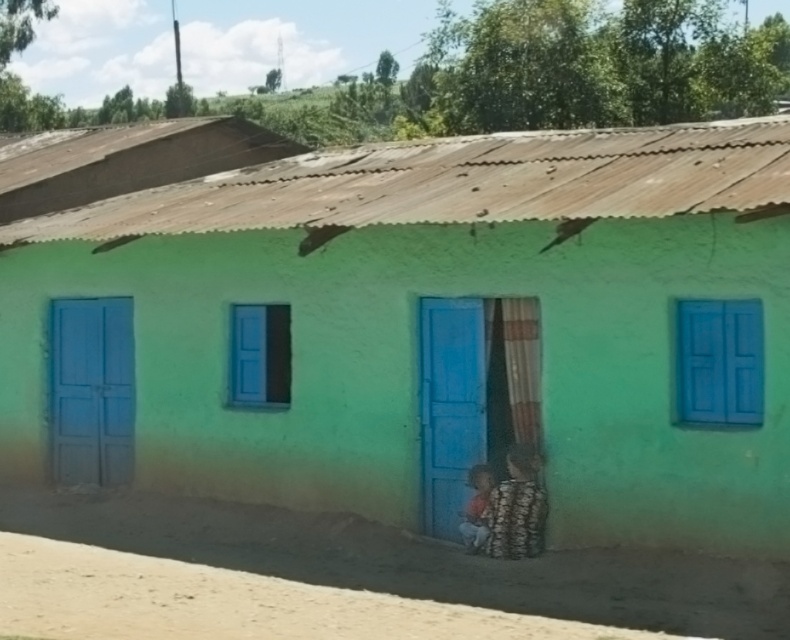
Question: Considering the real-world distances, which object is farthest from the green matte house at center?

Choices:
 (A) matte blue door at left
 (B) blue matte door at center

Answer: (A)

Question: Is green matte house at center to the right of blue matte door at center from the viewer's perspective?

Choices:
 (A) no
 (B) yes

Answer: (A)

Question: Which point is farther to the camera?

Choices:
 (A) blue matte door at center
 (B) green matte house at center
 (C) matte blue door at left

Answer: (C)

Question: Where is green matte house at center located in relation to blue matte door at center in the image?

Choices:
 (A) right
 (B) left

Answer: (B)

Question: Which point is closer to the camera?

Choices:
 (A) matte blue door at left
 (B) blue matte door at center

Answer: (B)

Question: Can you confirm if green matte house at center is smaller than blue matte door at center?

Choices:
 (A) no
 (B) yes

Answer: (B)